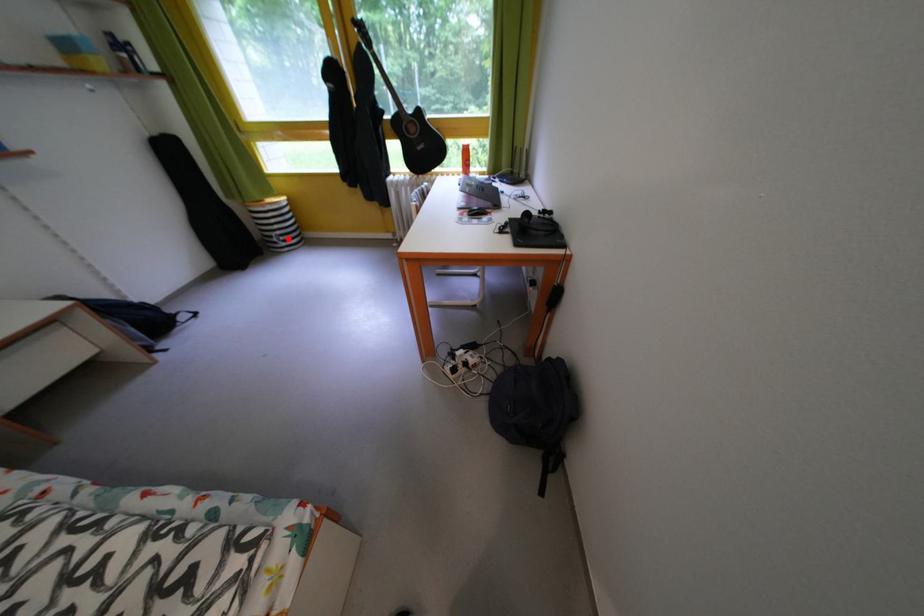
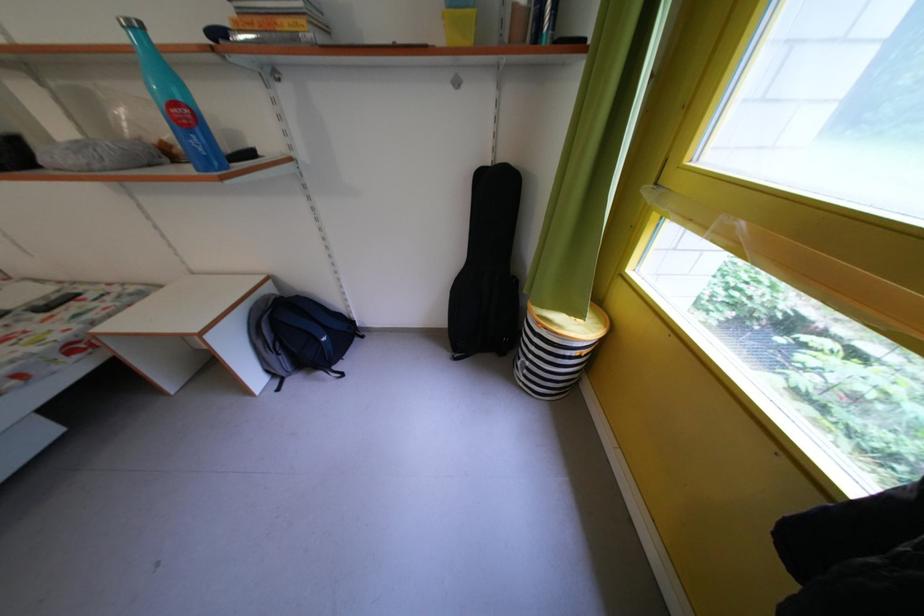
In the second image, find the point that corresponds to the highlighted location in the first image.

(537, 369)